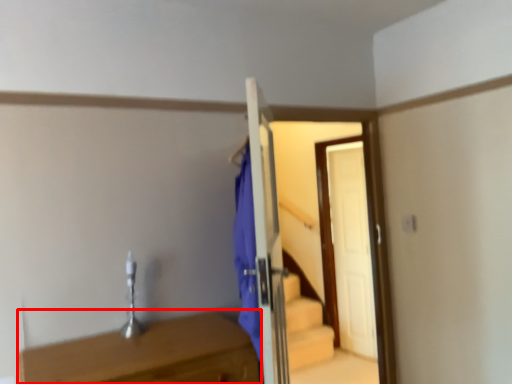
Question: From the image's perspective, where is table (annotated by the red box) located relative to door?

Choices:
 (A) above
 (B) below

Answer: (B)